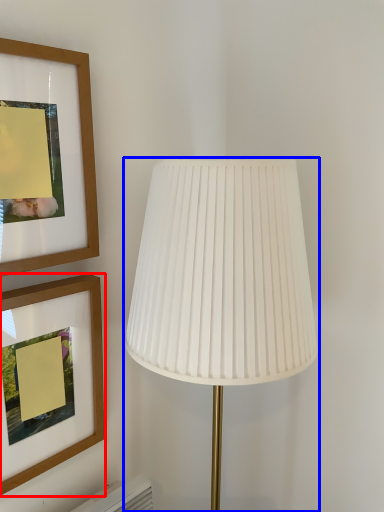
Question: Which point is closer to the camera, picture frame (highlighted by a red box) or lamp (highlighted by a blue box)?

Choices:
 (A) picture frame
 (B) lamp

Answer: (B)